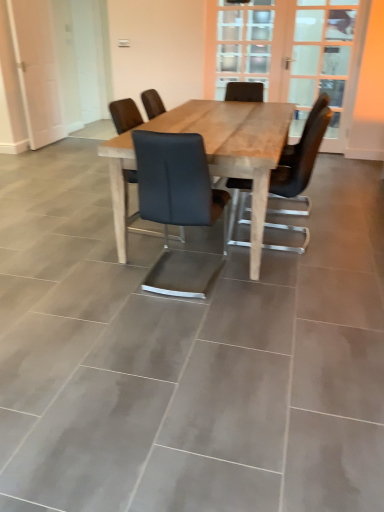
Question: Is natural wood table at center shorter than clear glass door at upper center, positioned as the first screen door in right-to-left order?

Choices:
 (A) no
 (B) yes

Answer: (B)

Question: Are natural wood table at center and clear glass door at upper center, positioned as the first screen door in right-to-left order, far apart?

Choices:
 (A) no
 (B) yes

Answer: (B)

Question: Considering the relative positions of natural wood table at center and clear glass door at upper center, which is the second screen door from left to right, in the image provided, is natural wood table at center to the right of clear glass door at upper center, which is the second screen door from left to right, from the viewer's perspective?

Choices:
 (A) no
 (B) yes

Answer: (A)

Question: Can you see natural wood table at center touching clear glass door at upper center, which is the second screen door from left to right?

Choices:
 (A) no
 (B) yes

Answer: (A)

Question: Considering the relative sizes of natural wood table at center and clear glass door at upper center, positioned as the first screen door in right-to-left order, in the image provided, is natural wood table at center bigger than clear glass door at upper center, positioned as the first screen door in right-to-left order,?

Choices:
 (A) no
 (B) yes

Answer: (B)

Question: In the image, is matte black chair at center, placed as the 1th chair when sorted from left to right, on the left side or the right side of clear glass door at upper center, which is the second screen door from left to right?

Choices:
 (A) left
 (B) right

Answer: (A)

Question: Considering their positions, is matte black chair at center, placed as the 1th chair when sorted from left to right, located in front of or behind clear glass door at upper center, positioned as the first screen door in right-to-left order?

Choices:
 (A) behind
 (B) front

Answer: (B)

Question: Looking at their shapes, would you say matte black chair at center, marked as the 3th chair in a right-to-left arrangement, is wider or thinner than clear glass door at upper center, positioned as the first screen door in right-to-left order?

Choices:
 (A) wide
 (B) thin

Answer: (A)

Question: In terms of size, does matte black chair at center, marked as the 3th chair in a right-to-left arrangement, appear bigger or smaller than clear glass door at upper center, which is the second screen door from left to right?

Choices:
 (A) big
 (B) small

Answer: (B)

Question: Considering the positions of clear glass door at upper center, which is the second screen door from left to right, and black leather chair at center, acting as the 2th chair starting from the left, in the image, is clear glass door at upper center, which is the second screen door from left to right, bigger or smaller than black leather chair at center, acting as the 2th chair starting from the left,?

Choices:
 (A) small
 (B) big

Answer: (B)

Question: From a real-world perspective, is clear glass door at upper center, positioned as the first screen door in right-to-left order, positioned above or below black leather chair at center, the second chair in the right-to-left sequence?

Choices:
 (A) above
 (B) below

Answer: (A)

Question: Considering the positions of clear glass door at upper center, which is the second screen door from left to right, and black leather chair at center, the second chair in the right-to-left sequence, in the image, is clear glass door at upper center, which is the second screen door from left to right, taller or shorter than black leather chair at center, the second chair in the right-to-left sequence,?

Choices:
 (A) tall
 (B) short

Answer: (A)

Question: Considering the positions of point (x=221, y=48) and point (x=145, y=281), is point (x=221, y=48) closer or farther from the camera than point (x=145, y=281)?

Choices:
 (A) closer
 (B) farther

Answer: (B)

Question: Relative to matte black chair at center, marked as the 3th chair in a right-to-left arrangement, is natural wood table at center in front or behind?

Choices:
 (A) behind
 (B) front

Answer: (B)

Question: From a real-world perspective, is natural wood table at center above or below matte black chair at center, marked as the 3th chair in a right-to-left arrangement?

Choices:
 (A) below
 (B) above

Answer: (A)